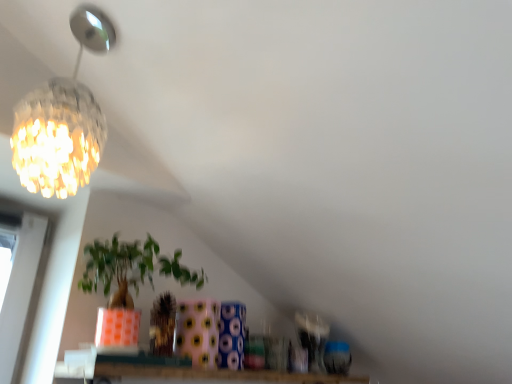
Question: Can you confirm if crystalline glass chandelier at upper left is bigger than matte orange pot at center?

Choices:
 (A) yes
 (B) no

Answer: (B)

Question: Can you confirm if crystalline glass chandelier at upper left is smaller than matte orange pot at center?

Choices:
 (A) no
 (B) yes

Answer: (B)

Question: Can you confirm if crystalline glass chandelier at upper left is taller than matte orange pot at center?

Choices:
 (A) no
 (B) yes

Answer: (B)

Question: Does crystalline glass chandelier at upper left turn towards matte orange pot at center?

Choices:
 (A) no
 (B) yes

Answer: (A)

Question: Is crystalline glass chandelier at upper left directly adjacent to matte orange pot at center?

Choices:
 (A) yes
 (B) no

Answer: (B)

Question: From the image's perspective, is transparent glass window at lower center located above or below matte orange pot at center?

Choices:
 (A) below
 (B) above

Answer: (A)

Question: Looking at their shapes, would you say transparent glass window at lower center is wider or thinner than matte orange pot at center?

Choices:
 (A) wide
 (B) thin

Answer: (B)

Question: From a real-world perspective, is transparent glass window at lower center physically located above or below matte orange pot at center?

Choices:
 (A) above
 (B) below

Answer: (B)

Question: Considering the positions of transparent glass window at lower center and matte orange pot at center in the image, is transparent glass window at lower center bigger or smaller than matte orange pot at center?

Choices:
 (A) big
 (B) small

Answer: (B)

Question: Considering the positions of point (222, 370) and point (38, 114), is point (222, 370) closer or farther from the camera than point (38, 114)?

Choices:
 (A) closer
 (B) farther

Answer: (B)

Question: Considering the positions of transparent glass window at lower center and crystalline glass chandelier at upper left in the image, is transparent glass window at lower center wider or thinner than crystalline glass chandelier at upper left?

Choices:
 (A) thin
 (B) wide

Answer: (B)

Question: In terms of height, does transparent glass window at lower center look taller or shorter compared to crystalline glass chandelier at upper left?

Choices:
 (A) short
 (B) tall

Answer: (A)

Question: Is transparent glass window at lower center to the left or to the right of crystalline glass chandelier at upper left in the image?

Choices:
 (A) right
 (B) left

Answer: (A)

Question: Is matte orange pot at center bigger or smaller than crystalline glass chandelier at upper left?

Choices:
 (A) small
 (B) big

Answer: (B)

Question: Is matte orange pot at center inside or outside of crystalline glass chandelier at upper left?

Choices:
 (A) outside
 (B) inside

Answer: (A)